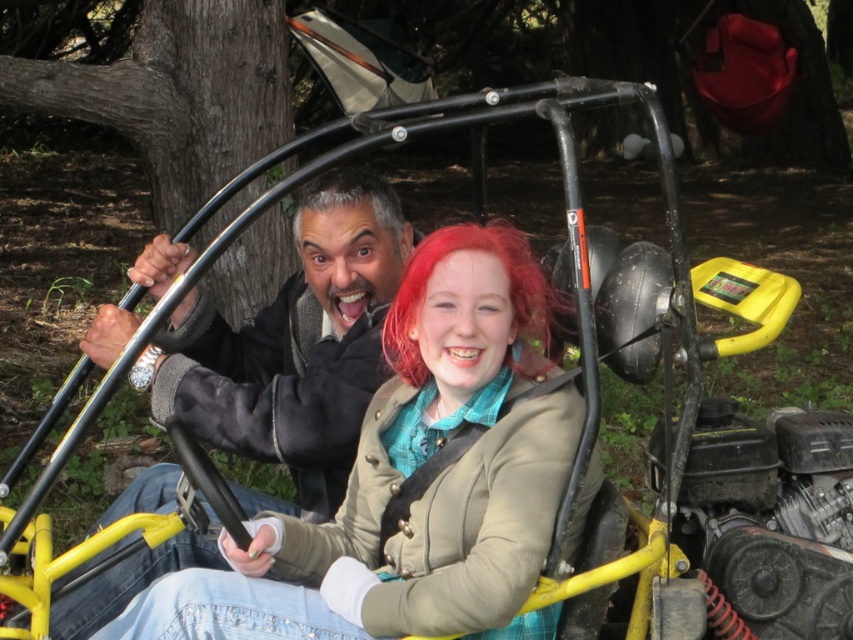
In the scene shown: You are a photographer standing 30 inches away from the vehicle. You want to take a closeup photo of the matte beige jacket at center without including the gray matte hair at center in the frame. Is this possible based on the current positions?

The matte beige jacket at center is 29.56 inches away from gray matte hair at center. Since you are standing 30 inches away from the vehicle, you can position yourself slightly closer to the jacket and angle the camera to exclude the gray matte hair at center, as the distance between them allows for such framing.

You are a photographer taking a picture of the matte beige jacket at center and the gray matte hair at center. Which object will appear larger in your photo?

The matte beige jacket at center will appear larger in the photo because it is closer to the viewer than the gray matte hair at center.

You are a fashion designer observing the matte beige jacket at center and the gray matte hair at center. Which object has a larger size?

The matte beige jacket at center has a larger size compared to the gray matte hair at center.